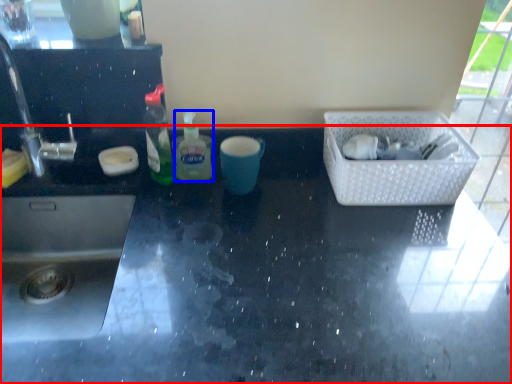
Question: Which object is further to the camera taking this photo, countertop (highlighted by a red box) or bottle (highlighted by a blue box)?

Choices:
 (A) countertop
 (B) bottle

Answer: (B)